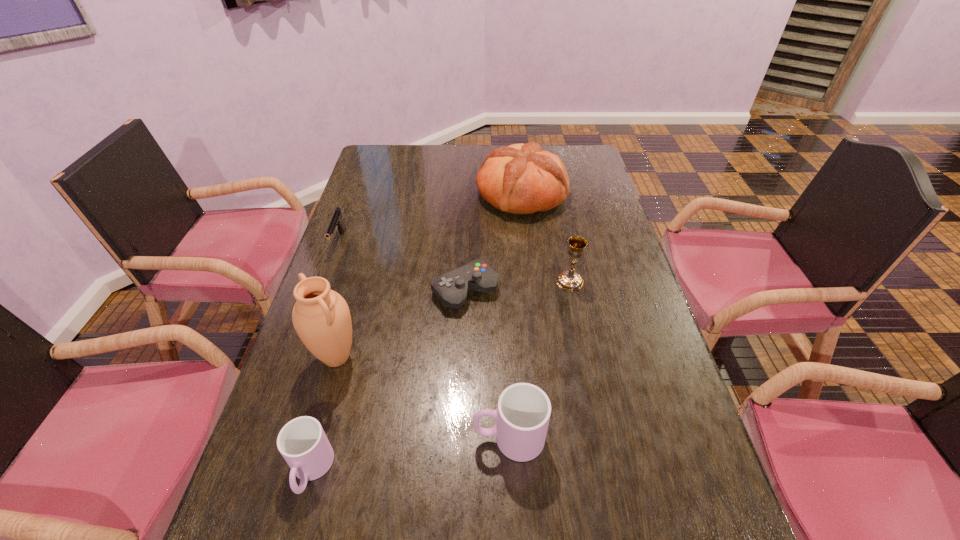
In the image, there is a desktop. At what (x,y) coordinates should I click in order to perform the action: click on blank space at the right edge. Please return your answer as a coordinate pair (x, y). The image size is (960, 540). Looking at the image, I should click on (629, 296).

This screenshot has width=960, height=540. In the image, there is a desktop. In order to click on free space at the far right corner in this screenshot , I will do `click(581, 146)`.

Where is `vacant area that lies between the right cup and the shorter cup`? The height and width of the screenshot is (540, 960). vacant area that lies between the right cup and the shorter cup is located at coordinates click(410, 455).

The width and height of the screenshot is (960, 540). In order to click on free space that is in between the chalice and the shortest object in this screenshot , I will do `click(517, 286)`.

Find the location of `unoccupied area between the tallest object and the right cup`. unoccupied area between the tallest object and the right cup is located at coordinates (422, 398).

Find the location of a particular element. The height and width of the screenshot is (540, 960). unoccupied position between the right cup and the chalice is located at coordinates (540, 360).

Locate an element on the screen. This screenshot has height=540, width=960. blank region between the chalice and the pistol is located at coordinates (454, 261).

The image size is (960, 540). Find the location of `vacant space in between the right cup and the chalice`. vacant space in between the right cup and the chalice is located at coordinates (540, 360).

At what (x,y) coordinates should I click in order to perform the action: click on vacant area that lies between the taller cup and the urn. Please return your answer as a coordinate pair (x, y). Looking at the image, I should click on point(422,398).

The image size is (960, 540). I want to click on free space that is in between the right cup and the urn, so click(x=422, y=398).